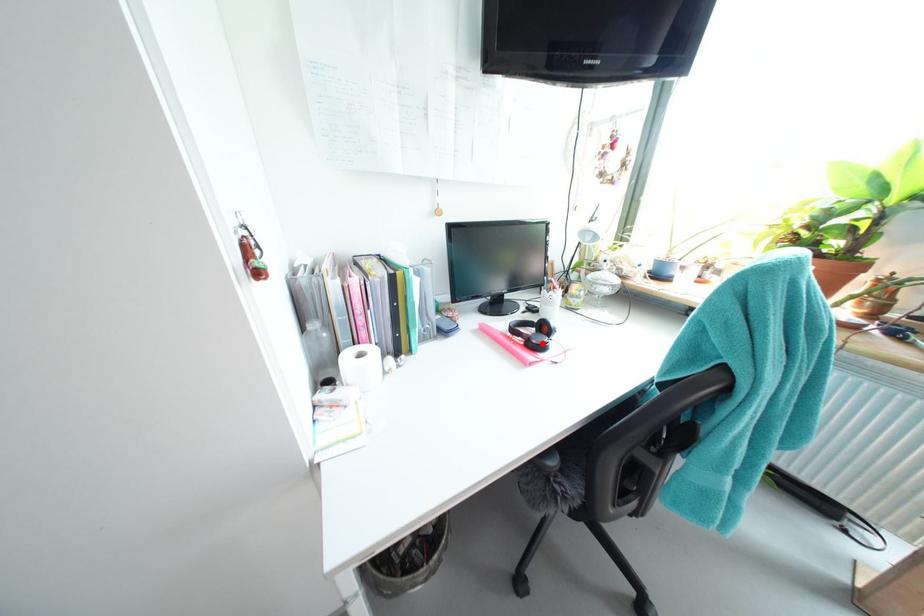
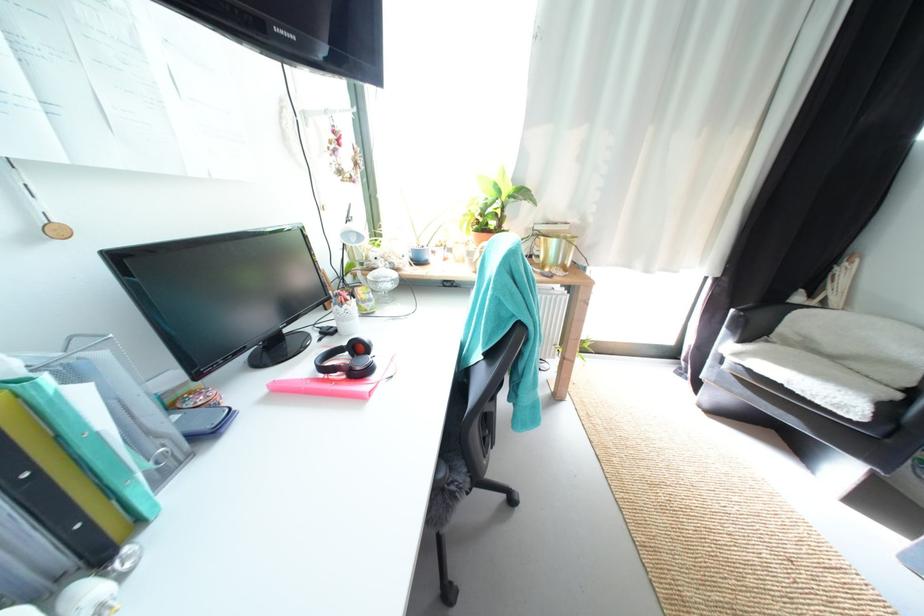
Locate, in the second image, the point that corresponds to the highlighted location in the first image.

(367, 370)